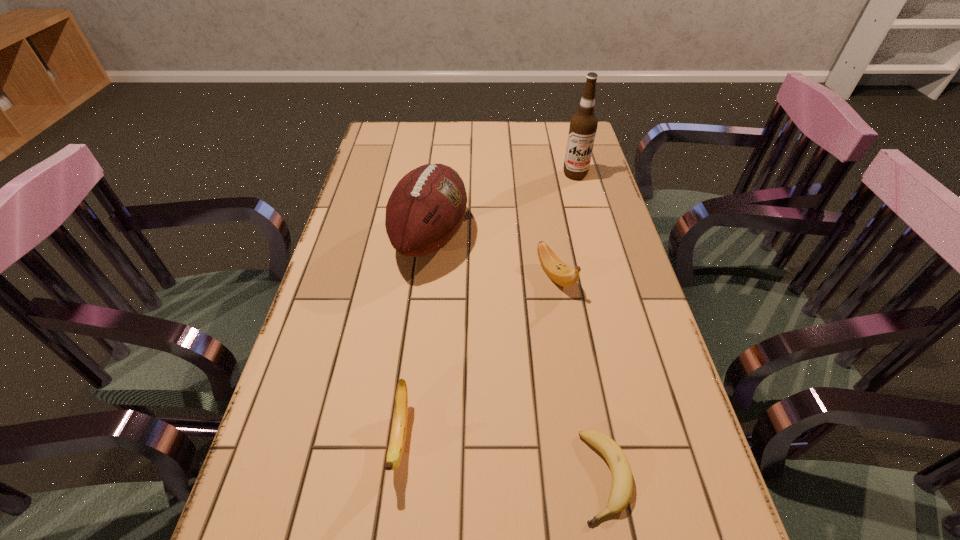
At what (x,y) coordinates should I click in order to perform the action: click on alcohol. Please return your answer as a coordinate pair (x, y). The image size is (960, 540). Looking at the image, I should click on (583, 126).

Where is `the tallest object`? This screenshot has width=960, height=540. the tallest object is located at coordinates (583, 126).

At what (x,y) coordinates should I click in order to perform the action: click on the second tallest object. Please return your answer as a coordinate pair (x, y). This screenshot has height=540, width=960. Looking at the image, I should click on (425, 210).

You are a GUI agent. You are given a task and a screenshot of the screen. Output one action in this format:
    pyautogui.click(x=<x>, y=<y>)
    Task: Click on the farthest banana
    This screenshot has width=960, height=540.
    Given the screenshot: What is the action you would take?
    pyautogui.click(x=562, y=274)

Find the location of a particular element. the leftmost banana is located at coordinates (399, 427).

Where is `the shortest banana`? Image resolution: width=960 pixels, height=540 pixels. the shortest banana is located at coordinates (622, 480).

This screenshot has height=540, width=960. In order to click on free space located 0.220m on the label of the alcohol in this screenshot , I will do `click(588, 225)`.

Find the location of a particular element. The image size is (960, 540). free space located 0.360m on the back of the football (American) is located at coordinates (442, 141).

At what (x,y) coordinates should I click in order to perform the action: click on free space located on the front of the farthest banana. Please return your answer as a coordinate pair (x, y). The width and height of the screenshot is (960, 540). Looking at the image, I should click on (580, 423).

Locate an element on the screen. object at the left edge is located at coordinates (425, 210).